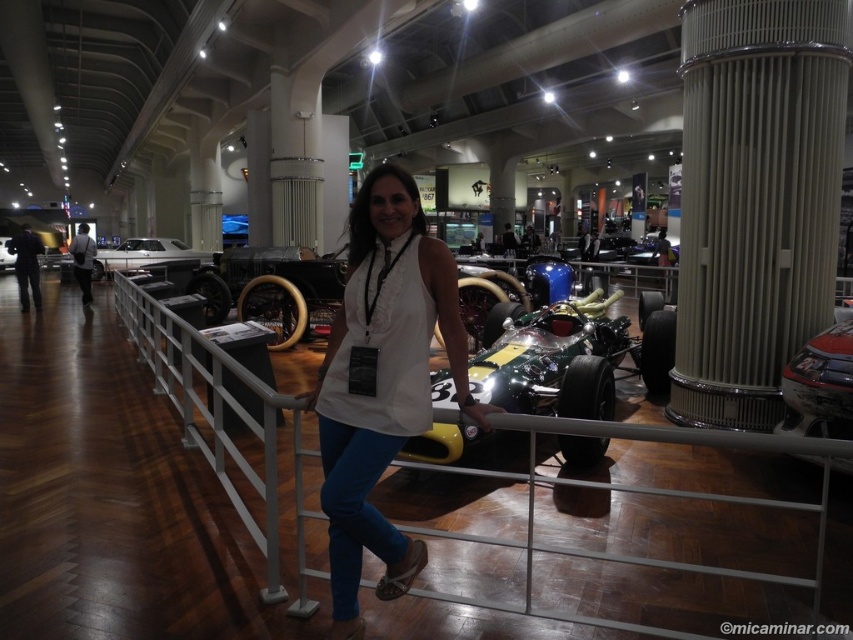
Question: Estimate the real-world distances between objects in this image. Which object is farther from the shiny silver car at center?

Choices:
 (A) shiny metallic race car at center
 (B) white fabric shirt at center
 (C) matte beige column at center right
 (D) shiny red car at center

Answer: (D)

Question: Does shiny metallic race car at center appear over shiny red car at center?

Choices:
 (A) no
 (B) yes

Answer: (B)

Question: Which point is farther from the camera taking this photo?

Choices:
 (A) (635, 344)
 (B) (146, 262)
 (C) (827, 342)
 (D) (405, 291)

Answer: (B)

Question: Which point appears closest to the camera in this image?

Choices:
 (A) (756, 204)
 (B) (149, 260)
 (C) (851, 378)
 (D) (560, 307)

Answer: (C)

Question: Can you confirm if matte beige column at center right is bigger than white fabric shirt at center?

Choices:
 (A) yes
 (B) no

Answer: (A)

Question: Is white fabric shirt at center closer to camera compared to shiny red car at center?

Choices:
 (A) no
 (B) yes

Answer: (B)